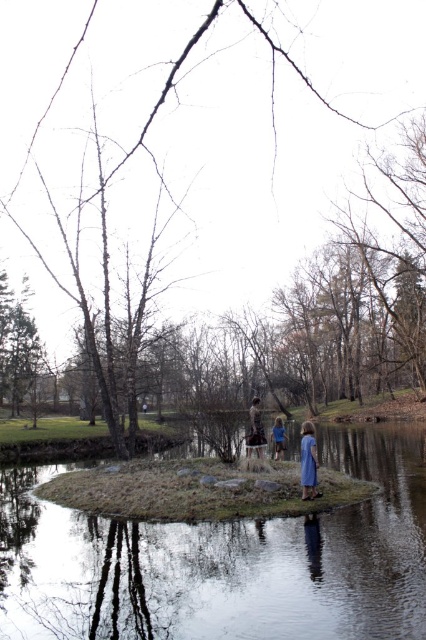
Question: Does brown bark tree at center have a greater width compared to clear water at center?

Choices:
 (A) no
 (B) yes

Answer: (B)

Question: Among these points, which one is nearest to the camera?

Choices:
 (A) (5, 608)
 (B) (89, 1)
 (C) (276, 452)
 (D) (313, 435)

Answer: (A)

Question: Does brown bark tree at center have a lesser width compared to clear water at center?

Choices:
 (A) yes
 (B) no

Answer: (B)

Question: Which of the following is the farthest from the observer?

Choices:
 (A) dark brown leather jacket at center
 (B) blue fabric dress at center
 (C) blue cotton dress at center
 (D) clear water at center

Answer: (B)

Question: Which object is positioned closest to the brown bark tree at center?

Choices:
 (A) blue cotton dress at center
 (B) clear water at center
 (C) blue fabric dress at center

Answer: (B)

Question: Does clear water at center lie behind blue cotton dress at center?

Choices:
 (A) yes
 (B) no

Answer: (B)